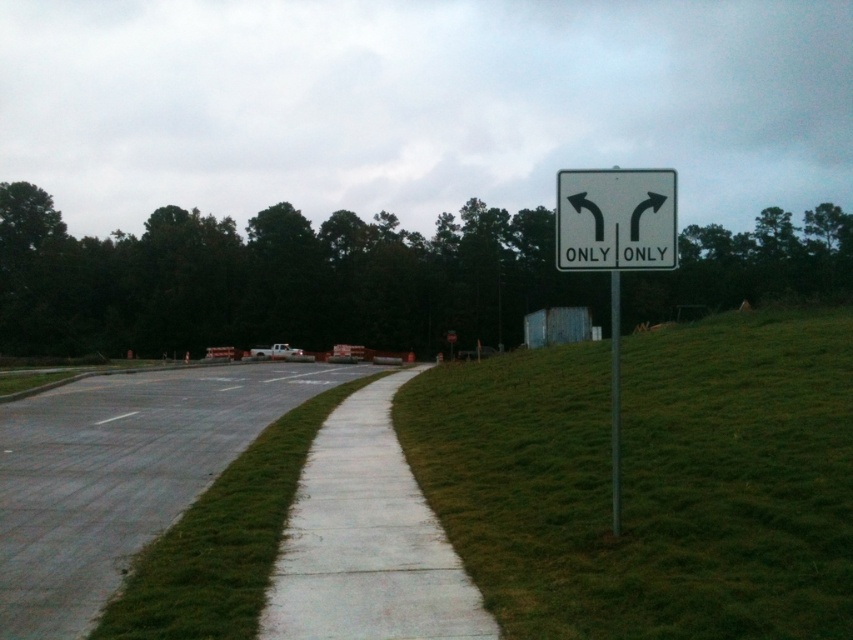
You are a delivery person carrying a package and need to cross the road safely. The white concrete sidewalk at center is your destination. Given that the road is 3 meters wide, can you reach the sidewalk without stepping into the road?

The white concrete sidewalk at center is 4.70 meters away from you. Since the road is only 3 meters wide, you can safely reach the sidewalk without stepping into the road by moving sideways around the road.

You are a pedestrian standing on the sidewalk and want to walk towards the green grass at right and the metallic pole at right. Which object will you reach first?

The green grass at right is closer to the viewer than the metallic pole at right, so you will reach the green grass at right first.